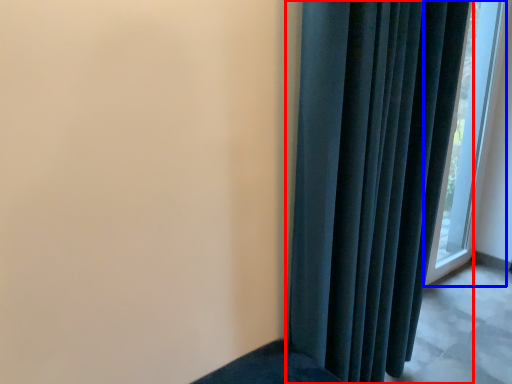
Question: Which object appears closest to the camera in this image, curtain (highlighted by a red box) or window (highlighted by a blue box)?

Choices:
 (A) curtain
 (B) window

Answer: (A)